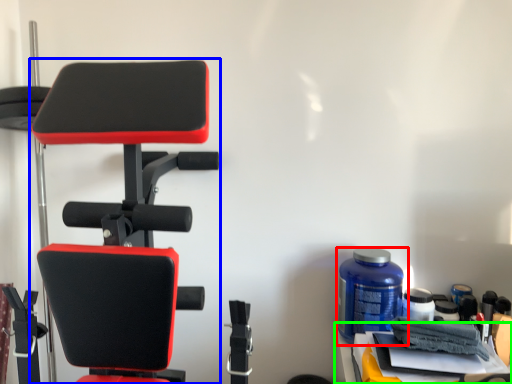
Question: Estimate the real-world distances between objects in this image. Which object is closer to bottle (highlighted by a red box), chair (highlighted by a blue box) or table (highlighted by a green box)?

Choices:
 (A) chair
 (B) table

Answer: (B)